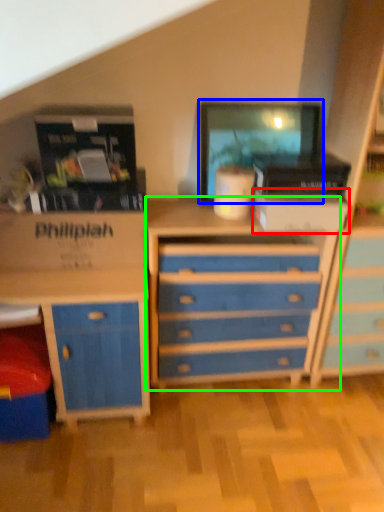
Question: Which object is the farthest from storage box (highlighted by a red box)? Choose among these: computer monitor (highlighted by a blue box) or chest of drawers (highlighted by a green box).

Choices:
 (A) computer monitor
 (B) chest of drawers

Answer: (B)